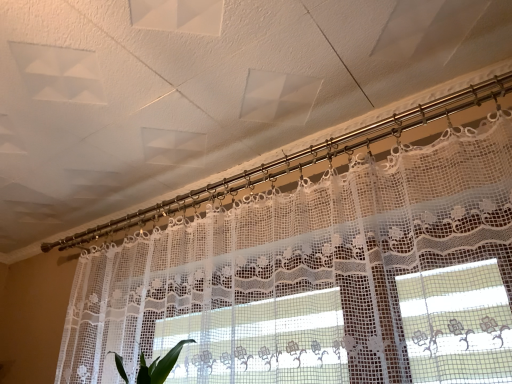
The image size is (512, 384). What do you see at coordinates (319, 278) in the screenshot?
I see `white lace curtain at upper center` at bounding box center [319, 278].

At what (x,y) coordinates should I click in order to perform the action: click on white lace curtain at upper center. Please return your answer as a coordinate pair (x, y). This screenshot has width=512, height=384. Looking at the image, I should click on (319, 278).

I want to click on white lace curtain at upper center, so click(319, 278).